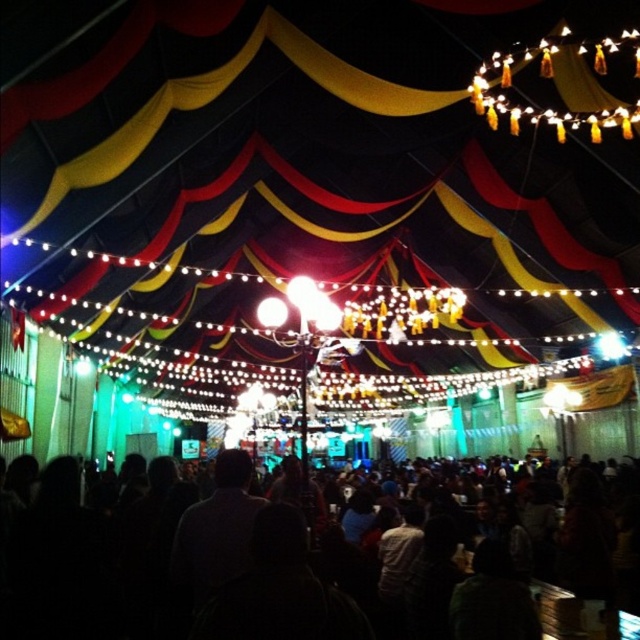
Question: Is yellow fabric canopy at upper center to the right of black matte crowd at center from the viewer's perspective?

Choices:
 (A) yes
 (B) no

Answer: (B)

Question: Is yellow fabric canopy at upper center wider than black matte crowd at center?

Choices:
 (A) no
 (B) yes

Answer: (B)

Question: Which point appears closest to the camera in this image?

Choices:
 (A) (353, 33)
 (B) (529, 602)

Answer: (B)

Question: Does yellow fabric canopy at upper center lie behind black matte crowd at center?

Choices:
 (A) no
 (B) yes

Answer: (B)